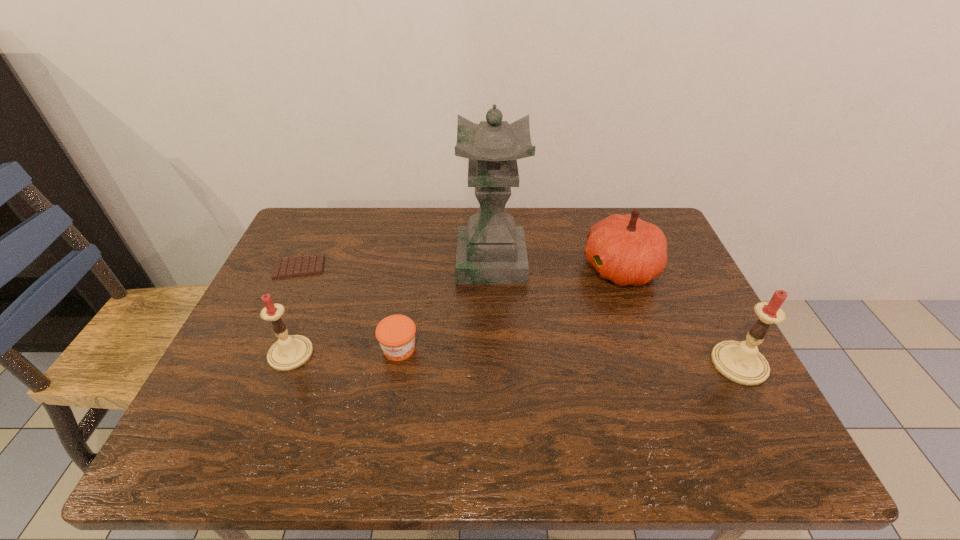
Find the location of `vacant area between the second object from right to left and the fourth object from right to left`. vacant area between the second object from right to left and the fourth object from right to left is located at coordinates (510, 308).

Point out which object is positioned as the fifth nearest to the taller candle. Please provide its 2D coordinates. Your answer should be formatted as a tuple, i.e. [(x, y)], where the tuple contains the x and y coordinates of a point satisfying the conditions above.

[(306, 265)]

Point out which object is positioned as the fifth nearest to the sculpture. Please provide its 2D coordinates. Your answer should be formatted as a tuple, i.e. [(x, y)], where the tuple contains the x and y coordinates of a point satisfying the conditions above.

[(741, 362)]

Where is `free space that satisfies the following two spatial constraints: 1. on the front-facing side of the fifth object from left to right; 2. on the left side of the taller candle`? The width and height of the screenshot is (960, 540). free space that satisfies the following two spatial constraints: 1. on the front-facing side of the fifth object from left to right; 2. on the left side of the taller candle is located at coordinates (656, 363).

The image size is (960, 540). Identify the location of vacant area in the image that satisfies the following two spatial constraints: 1. on the back side of the rightmost object; 2. at the front opening of the fourth object from left to right. (684, 261).

Locate an element on the screen. Image resolution: width=960 pixels, height=540 pixels. vacant region that satisfies the following two spatial constraints: 1. at the front opening of the tallest object; 2. on the front label of the fourth object from right to left is located at coordinates (493, 349).

Locate an element on the screen. The image size is (960, 540). free region that satisfies the following two spatial constraints: 1. on the front-facing side of the pumpkin; 2. on the back side of the right candle is located at coordinates (656, 363).

Find the location of a particular element. The height and width of the screenshot is (540, 960). vacant area in the image that satisfies the following two spatial constraints: 1. on the front label of the right candle; 2. on the left side of the second shortest object is located at coordinates click(x=396, y=363).

The width and height of the screenshot is (960, 540). Find the location of `free spot that satisfies the following two spatial constraints: 1. on the front side of the taller candle; 2. on the right side of the chocolate bar`. free spot that satisfies the following two spatial constraints: 1. on the front side of the taller candle; 2. on the right side of the chocolate bar is located at coordinates (254, 363).

Where is `free region that satisfies the following two spatial constraints: 1. on the front side of the shorter candle; 2. on the right side of the shortest object`? The width and height of the screenshot is (960, 540). free region that satisfies the following two spatial constraints: 1. on the front side of the shorter candle; 2. on the right side of the shortest object is located at coordinates (258, 354).